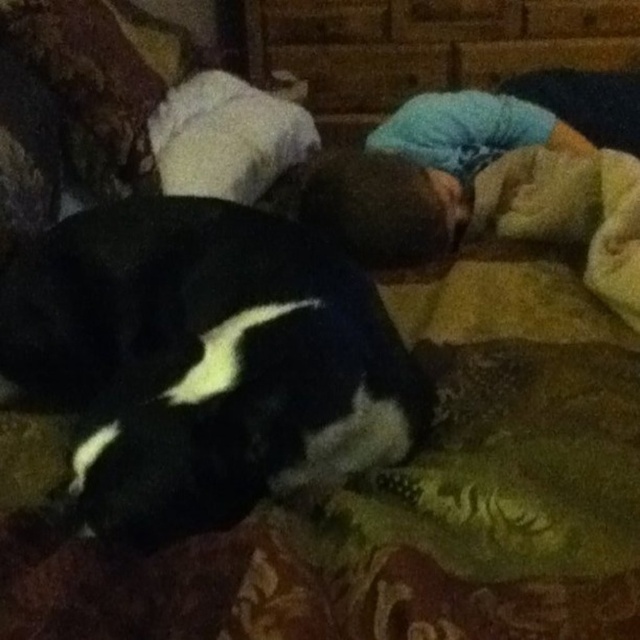
Question: Is the position of black and white fur at center more distant than that of blue cotton shirt at center?

Choices:
 (A) yes
 (B) no

Answer: (B)

Question: Is black and white fur at center to the left of blue cotton shirt at center from the viewer's perspective?

Choices:
 (A) yes
 (B) no

Answer: (A)

Question: Which object is closer to the camera taking this photo?

Choices:
 (A) blue cotton shirt at center
 (B) black and white fur at center

Answer: (B)

Question: Is black and white fur at center smaller than blue cotton shirt at center?

Choices:
 (A) no
 (B) yes

Answer: (B)